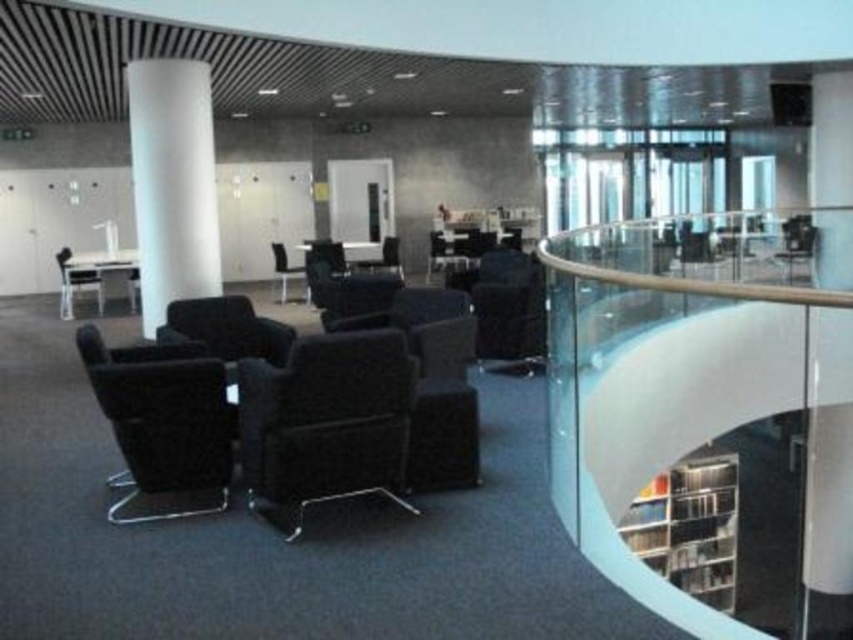
Question: Can you confirm if matte black armchair at left is wider than black leather armchair at center?

Choices:
 (A) yes
 (B) no

Answer: (A)

Question: Which object is the farthest from the matte black armchair at left?

Choices:
 (A) black leather chair at center
 (B) matte black chair at lower left
 (C) black matte bookshelf at lower right

Answer: (C)

Question: Is black leather chair at center to the right of matte black chair at center from the viewer's perspective?

Choices:
 (A) yes
 (B) no

Answer: (A)

Question: Among these points, which one is farthest from the camera?

Choices:
 (A) (200, 96)
 (B) (437, 234)
 (C) (795, 241)

Answer: (C)

Question: Does matte black chair at upper right appear on the right side of matte black chair at center?

Choices:
 (A) no
 (B) yes

Answer: (B)

Question: Which of the following is the closest to the observer?

Choices:
 (A) matte black chair at upper right
 (B) matte black chair at lower left

Answer: (B)